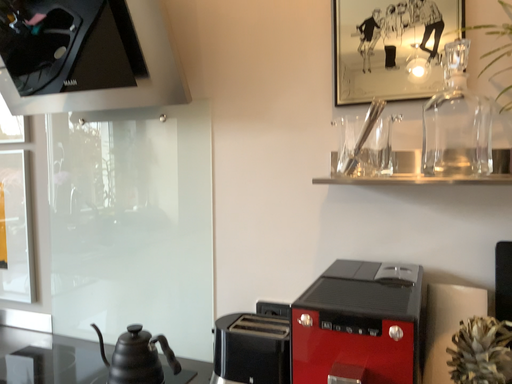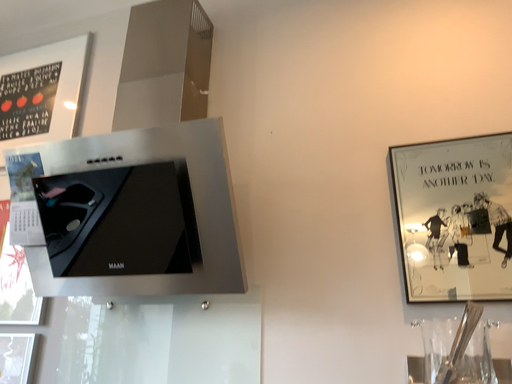
Question: How did the camera likely rotate when shooting the video?

Choices:
 (A) rotated upward
 (B) rotated downward

Answer: (A)